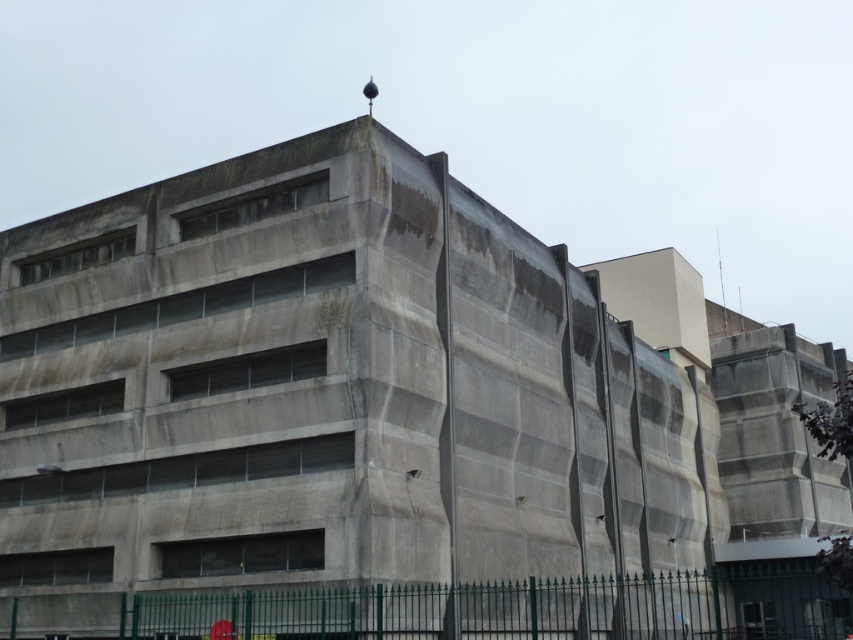
Question: Which point is farther from the camera taking this photo?

Choices:
 (A) (440, 477)
 (B) (32, 600)

Answer: (B)

Question: Is gray concrete building at center positioned behind green wrought iron fence at lower center?

Choices:
 (A) yes
 (B) no

Answer: (A)

Question: Does gray concrete building at center have a smaller size compared to green wrought iron fence at lower center?

Choices:
 (A) no
 (B) yes

Answer: (A)

Question: Is gray concrete building at center positioned before green wrought iron fence at lower center?

Choices:
 (A) no
 (B) yes

Answer: (A)

Question: Among these points, which one is farthest from the camera?

Choices:
 (A) (837, 602)
 (B) (502, 525)

Answer: (A)

Question: Which point is farther to the camera?

Choices:
 (A) (682, 616)
 (B) (659, 445)

Answer: (B)